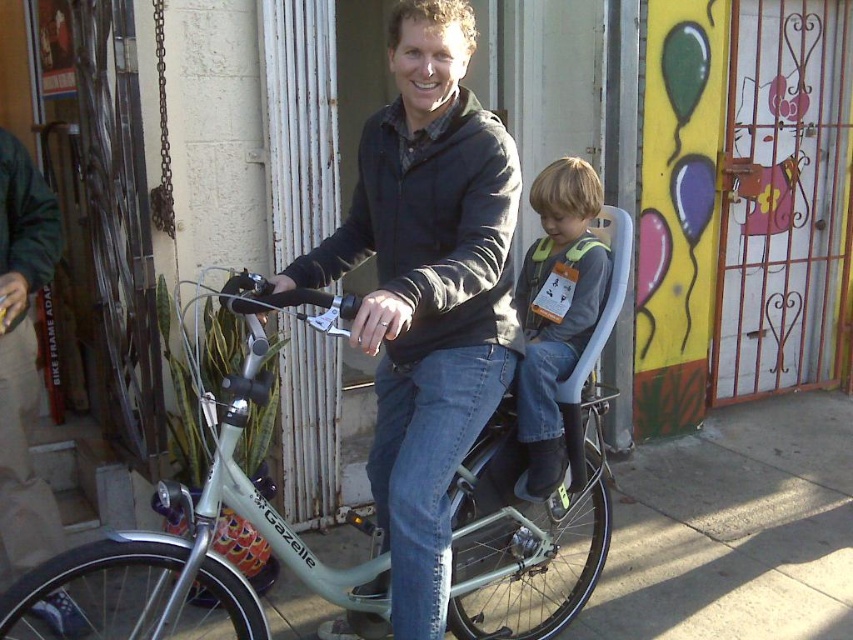
Question: Which of the following is the farthest from the observer?

Choices:
 (A) (592, 288)
 (B) (434, 497)

Answer: (A)

Question: Does matte gray jacket at center have a smaller size compared to matte silver bicycle at center?

Choices:
 (A) no
 (B) yes

Answer: (B)

Question: Among these points, which one is nearest to the camera?

Choices:
 (A) (474, 358)
 (B) (190, 365)

Answer: (A)

Question: Is matte gray jacket at center bigger than matte silver bicycle at center?

Choices:
 (A) yes
 (B) no

Answer: (B)

Question: Is matte gray jacket at center thinner than matte silver bicycle at center?

Choices:
 (A) no
 (B) yes

Answer: (B)

Question: Which object is farther from the camera taking this photo?

Choices:
 (A) matte silver bicycle at center
 (B) gray-green fabric vest at center

Answer: (B)